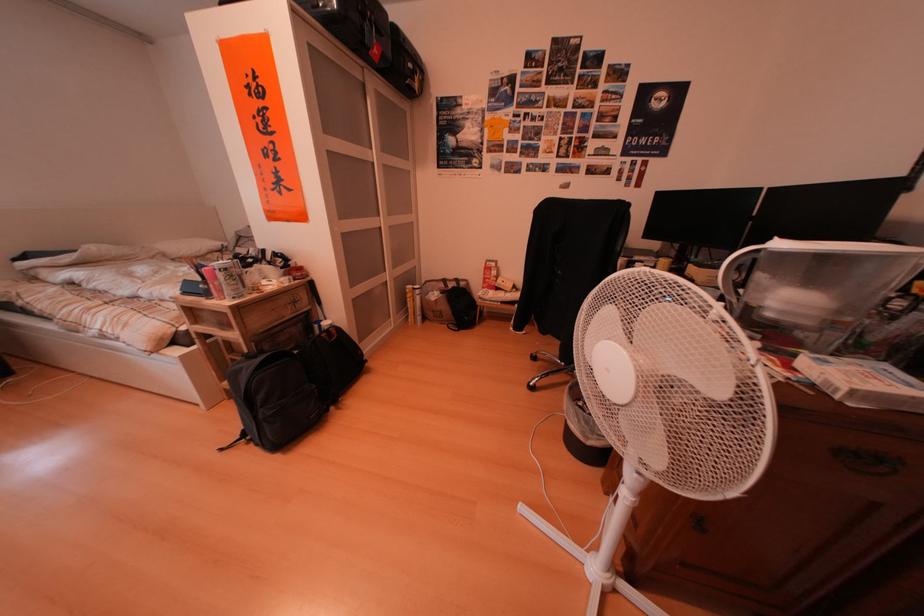
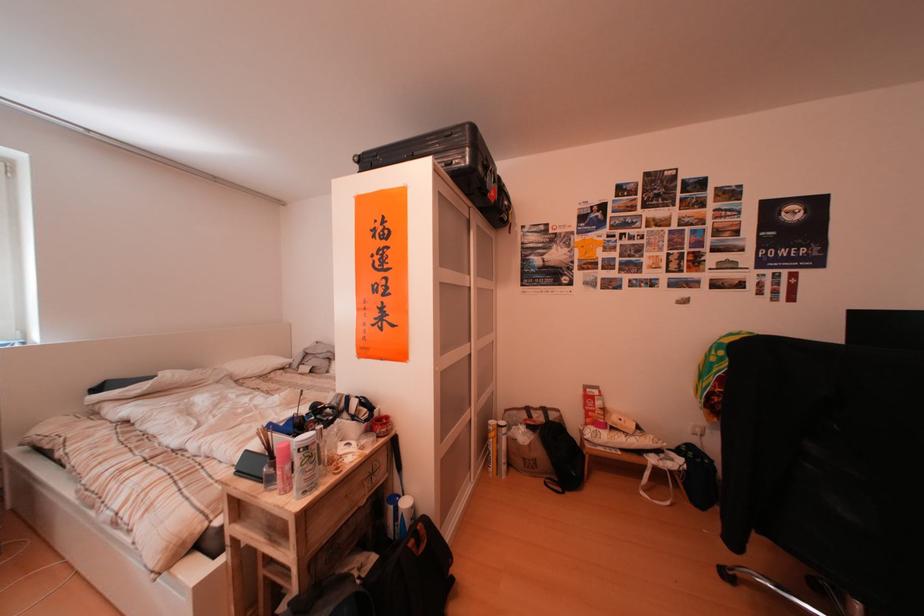
Question: I am providing you with two images of the same scene from different viewpoints. Which of the following objects are not visible in image2?

Choices:
 (A) brown paper bag
 (B) white container
 (C) red lidded jar
 (D) none of these

Answer: (D)